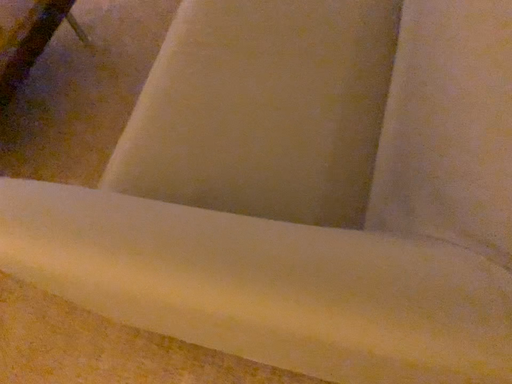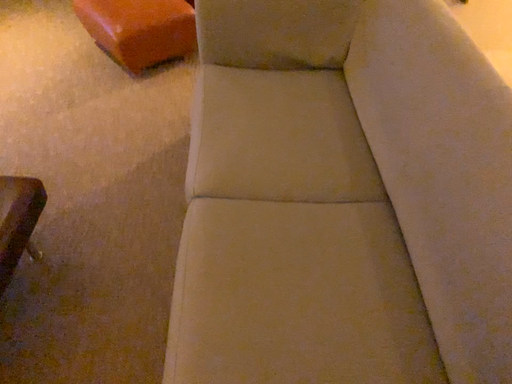
Question: How did the camera likely rotate when shooting the video?

Choices:
 (A) rotated left
 (B) rotated right

Answer: (B)